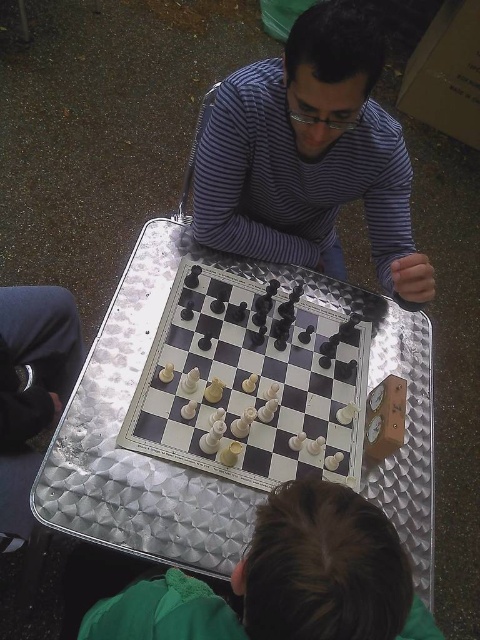
You are a photographer trying to capture a clear shot of the metallic chessboard at center without any obstructions. Given that the striped fabric shirt at upper center is in the frame, can you adjust your position to avoid the shirt blocking the view of the chessboard?

The striped fabric shirt at upper center is behind the metallic chessboard at center, so adjusting your position slightly sideways or forward might allow you to capture the chessboard without the shirt obstructing the view.

You are a photographer trying to capture the chess game. To ensure the metallic chessboard at center is clearly visible in your photo, should you adjust your focus to be closer to the green fabric at lower center or farther away?

The metallic chessboard at center is positioned over green fabric at lower center, so to focus on the chessboard, adjust your focus closer to the green fabric at lower center since the chessboard is above it.

Based on the photo, you are a chess player who wants to place a large decorative piece on the table. The metallic chessboard at center and the green fabric at lower center are on the table. Which object can you place it on without overlapping?

The metallic chessboard at center is bigger than green fabric at lower center, so you can place the large decorative piece on the metallic chessboard at center without overlapping.